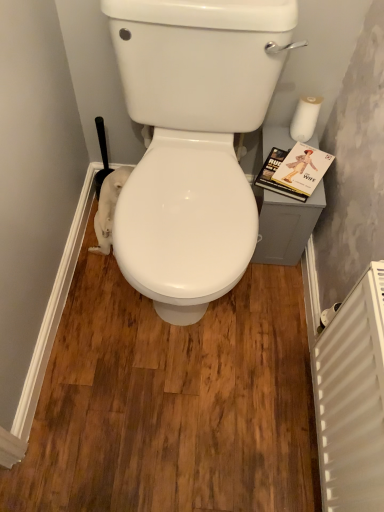
This screenshot has width=384, height=512. What are the coordinates of `free space on the front side of white glossy toilet at center` in the screenshot? It's located at (179, 388).